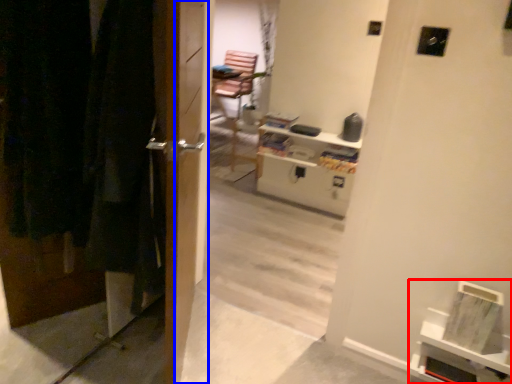
Question: Which object appears closest to the camera in this image, shelf (highlighted by a red box) or screen door (highlighted by a blue box)?

Choices:
 (A) shelf
 (B) screen door

Answer: (B)